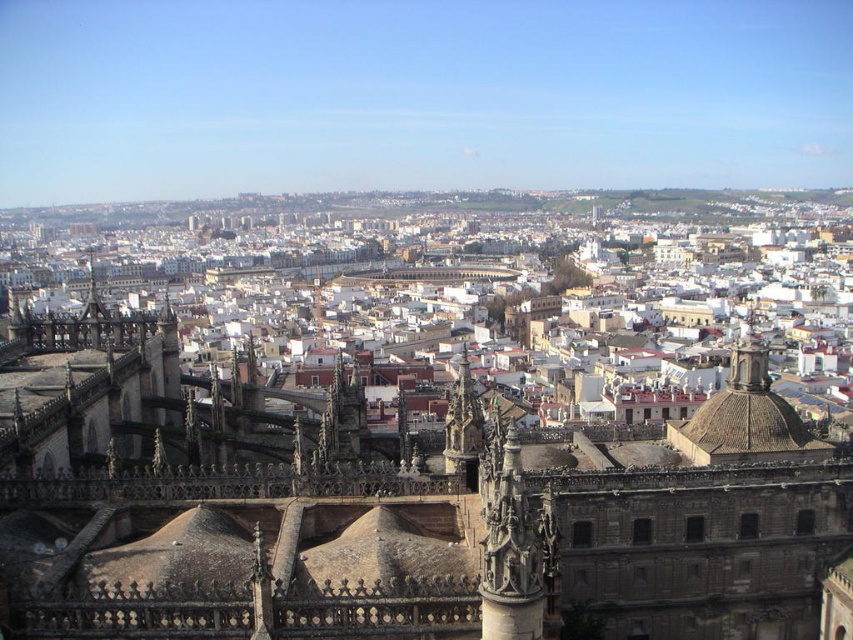
You are standing at the base of the Gothic structure and want to take a photo of the carved stone spire at center. If your camera has a maximum zoom range of 100 feet, will you be able to capture the spire clearly without moving closer?

The carved stone spire at center is 181.20 feet away from the camera. Since the camera can only zoom up to 100 feet, you will not be able to capture the spire clearly without moving closer.

You are standing on the rooftop of the dark brown stone tower at center and looking towards the carved stone spire at center. In which direction should you walk to reach it?

You should walk to your right because the carved stone spire at center is located to the right of the dark brown stone tower at center.